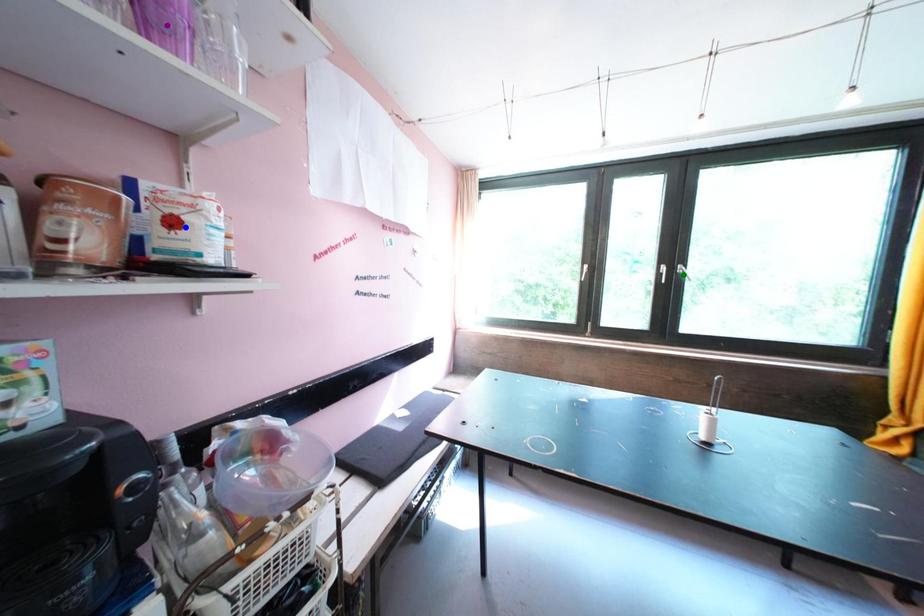
Order these from nearest to farthest:
1. purple point
2. blue point
3. green point

1. green point
2. blue point
3. purple point